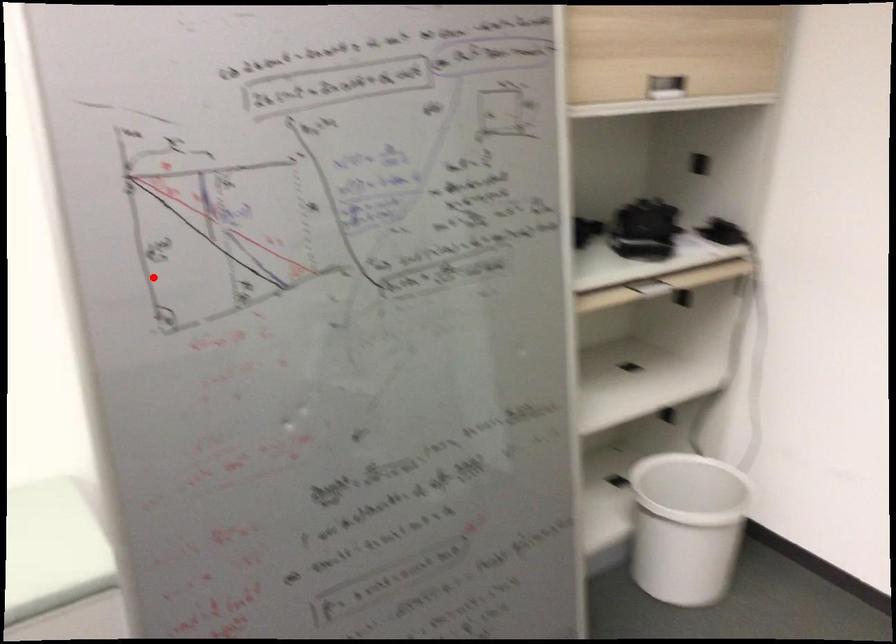
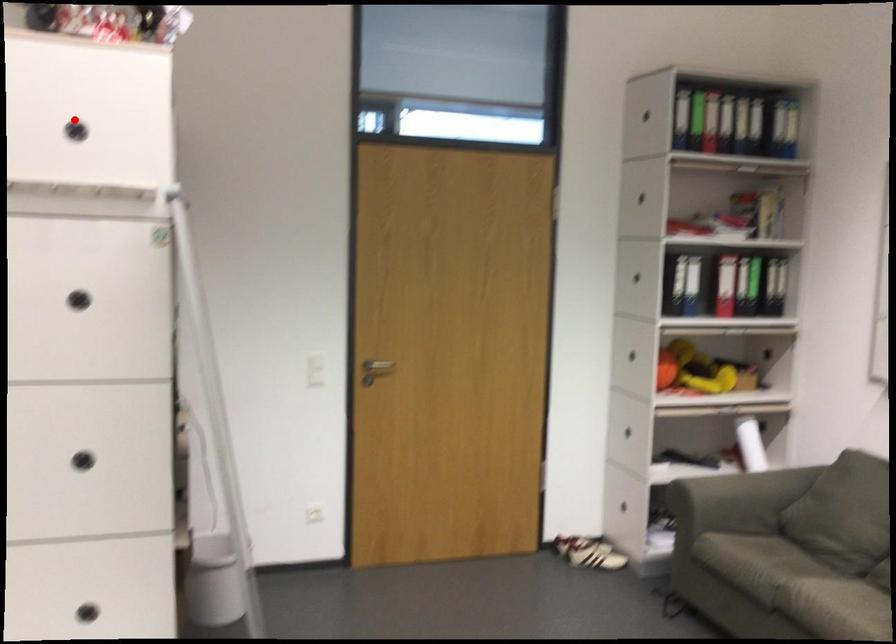
I am providing you with two images of the same scene from different viewpoints. A red point is marked on the first image and another point is marked on the second image. Is the red point in image1 aligned with the point shown in image2?

No